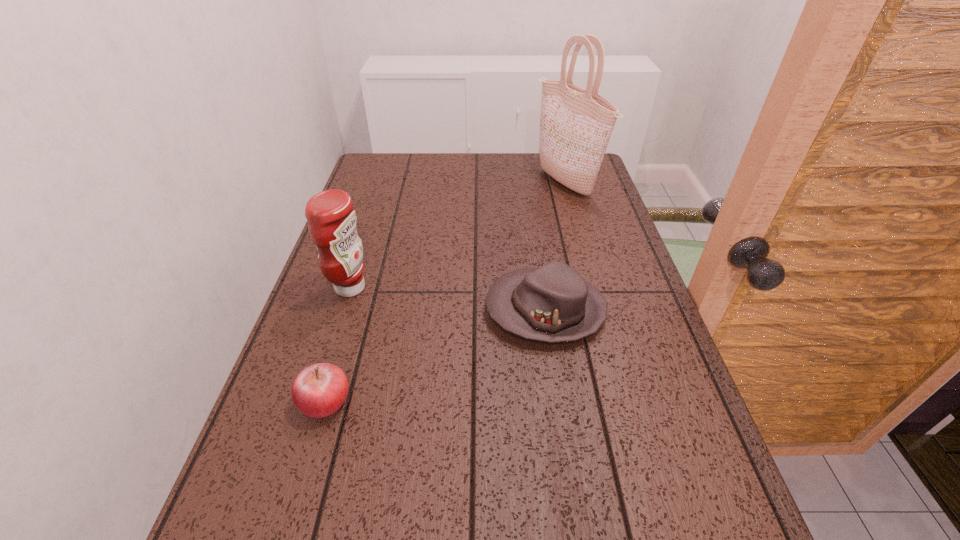
You are a GUI agent. You are given a task and a screenshot of the screen. Output one action in this format:
    pyautogui.click(x=<x>, y=<y>)
    Task: Click on the shopping bag
    The image size is (960, 540).
    Given the screenshot: What is the action you would take?
    pyautogui.click(x=576, y=124)

Where is `the farthest object`? the farthest object is located at coordinates (576, 124).

The width and height of the screenshot is (960, 540). I want to click on condiment, so click(x=331, y=217).

The width and height of the screenshot is (960, 540). In order to click on hat in this screenshot , I will do `click(553, 303)`.

At what (x,y) coordinates should I click in order to perform the action: click on the nearest object. Please return your answer as a coordinate pair (x, y). Looking at the image, I should click on (319, 390).

You are a GUI agent. You are given a task and a screenshot of the screen. Output one action in this format:
    pyautogui.click(x=<x>, y=<y>)
    Task: Click on the vacant space located 0.090m on the front of the shopping bag
    
    Given the screenshot: What is the action you would take?
    pyautogui.click(x=577, y=224)

Where is `free spot located 0.200m on the front of the second tallest object`? The image size is (960, 540). free spot located 0.200m on the front of the second tallest object is located at coordinates (323, 376).

What are the coordinates of `free location located 0.130m on the decorative side of the hat` in the screenshot? It's located at (430, 310).

This screenshot has height=540, width=960. Identify the location of free location located on the decorative side of the hat. (414, 310).

Where is `free space located 0.220m on the decorative side of the hat`? This screenshot has width=960, height=540. free space located 0.220m on the decorative side of the hat is located at coordinates (393, 310).